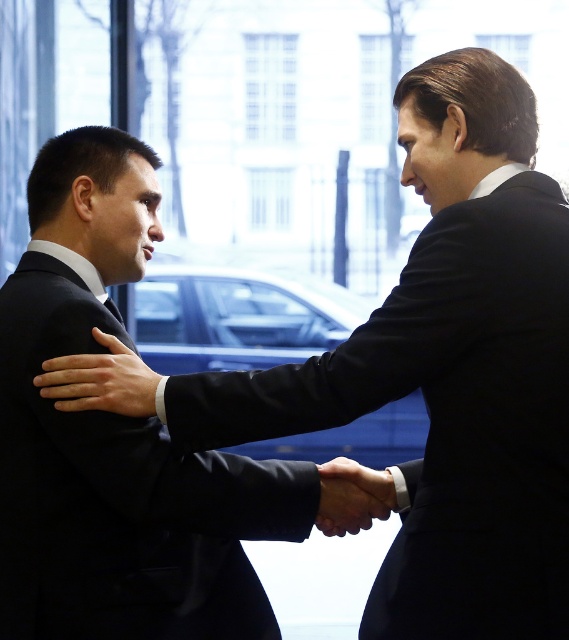
You are a photographer at a formal event. You need to position a spotlight so it shines on both the black satin suit at left and the smooth skin hand at center. Since the spotlight can only illuminate objects of a certain height, which object should you aim the spotlight at first to ensure both are lit?

The black satin suit at left is taller than the smooth skin hand at center, so you should aim the spotlight at the black satin suit at left first to ensure both are lit properly.

Consider the image. You are a photographer standing 10 feet away from the two men. You want to take a photo of them while ensuring both are in focus. The camera you are using has a depth of field that can sharply focus subjects within a 5 feet range. Can you capture both the black satin suit at left and the other man in focus?

The two men are 7.30 feet apart, which exceeds the camera depth of field range of 5 feet. Therefore, you cannot capture both the black satin suit at left and the other man in focus with the current camera settings.